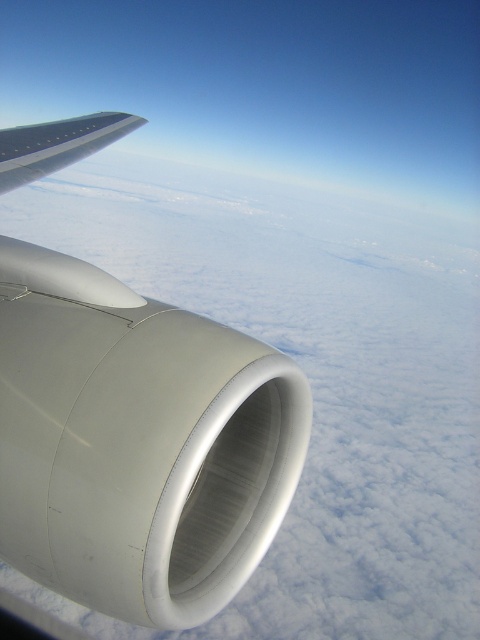
Is matte white jet engine at center thinner than silver metallic wing at upper left?

Correct, matte white jet engine at center's width is less than silver metallic wing at upper left's.

Between matte white jet engine at center and silver metallic wing at upper left, which one appears on the right side from the viewer's perspective?

matte white jet engine at center

Which is behind, point (12, 150) or point (24, 140)?

The point (24, 140) is more distant.

Locate an element on the screen. This screenshot has width=480, height=640. matte white jet engine at center is located at coordinates (136, 442).